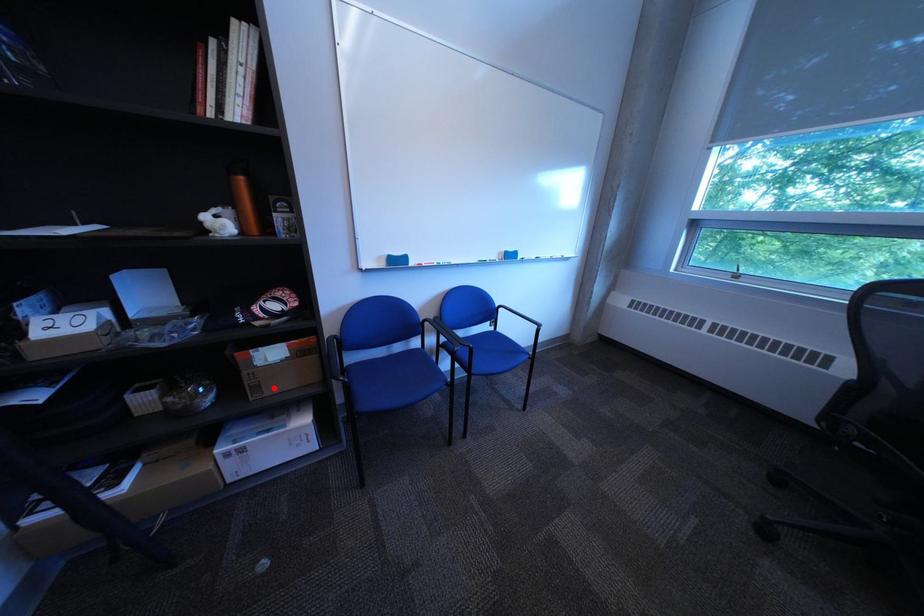
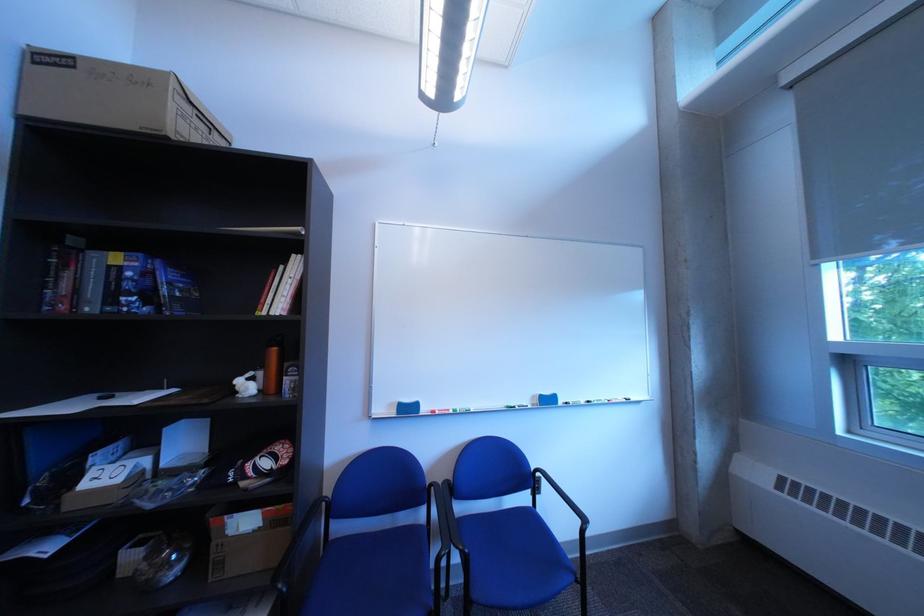
Question: I am providing you with two images of the same scene from different viewpoints. In image1, a red point is highlighted. Considering the same 3D point in image2, which of the following is correct?

Choices:
 (A) It is closer
 (B) It is farther

Answer: (B)